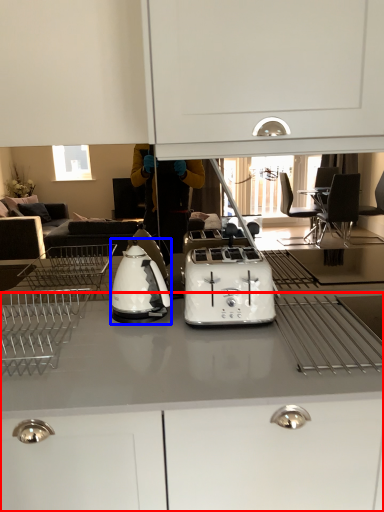
Question: Among these objects, which one is farthest to the camera, cabinetry (highlighted by a red box) or kitchen appliance (highlighted by a blue box)?

Choices:
 (A) cabinetry
 (B) kitchen appliance

Answer: (B)